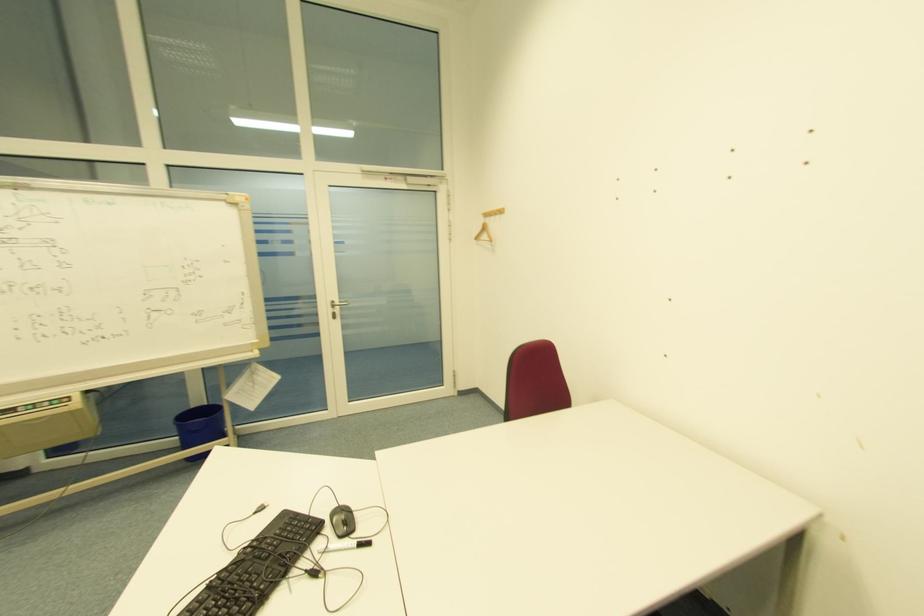
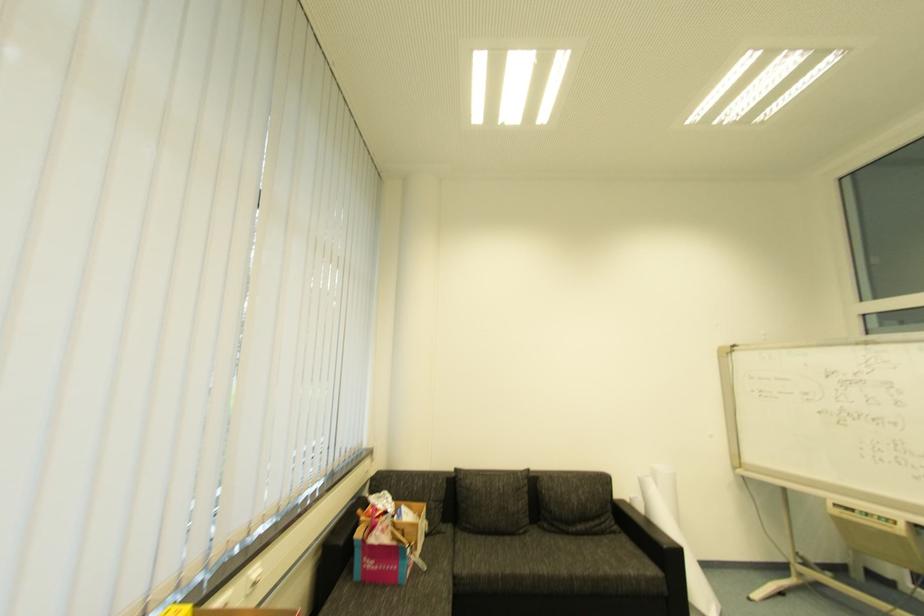
Question: The images are taken continuously from a first-person perspective. In which direction is your viewpoint rotating?

Choices:
 (A) Left
 (B) Right
 (C) Up
 (D) Down

Answer: (A)